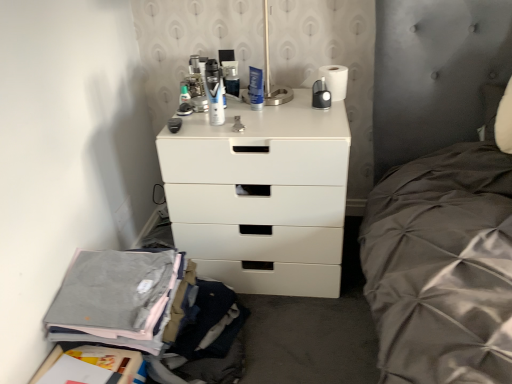
Identify the location of vacant space in between matte black shaving cream can at center, the 1th toiletry viewed from the front, and translucent plastic toothbrush at upper center, the first toiletry positioned from the left. This screenshot has height=384, width=512. (203, 117).